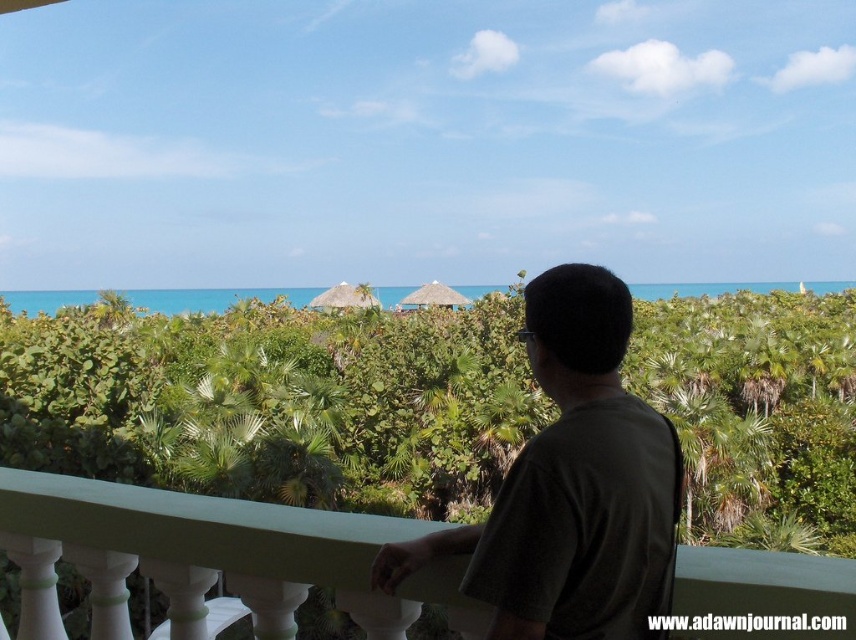
Does point (346, 589) come behind point (575, 561)?

That is True.

Does green painted wood railing at center have a lesser width compared to dark green t-shirt at center?

No.

This screenshot has height=640, width=856. What are the coordinates of `green painted wood railing at center` in the screenshot? It's located at (207, 557).

The image size is (856, 640). Find the location of `green painted wood railing at center`. green painted wood railing at center is located at coordinates (207, 557).